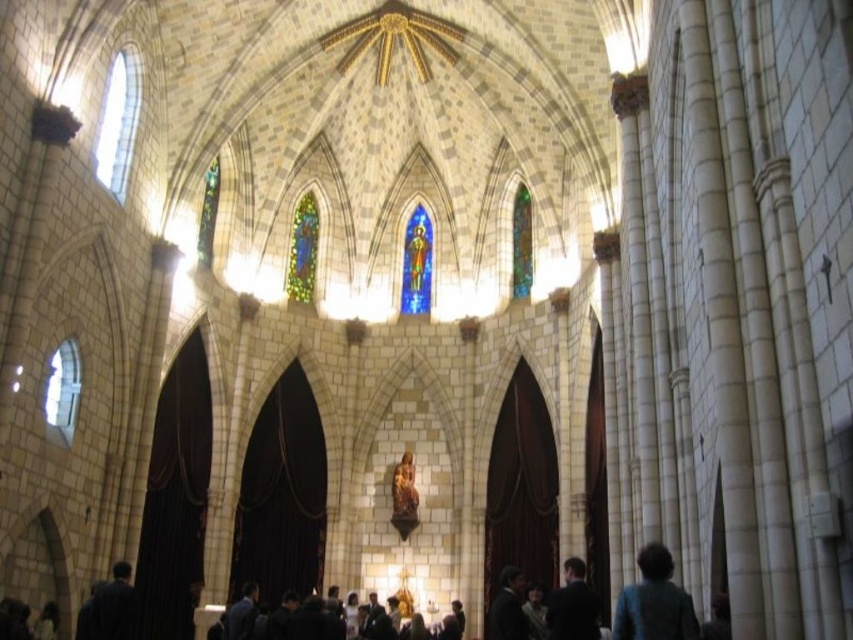
You are standing in the cathedral and notice two objects of interest. You see a dark suit at lower center and a multicolored stained glass at upper center. Which object is taller?

The multicolored stained glass at upper center is taller than the dark suit at lower center.

You are a photographer standing in the cathedral and want to capture both the teal fabric coat at lower right and the dark suit at lower center in a single shot. Which object will appear smaller in the photo?

The teal fabric coat at lower right will appear smaller in the photo because it is not as tall as the dark suit at lower center.